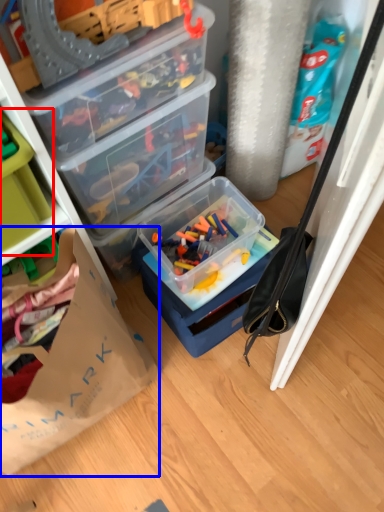
Question: Which of the following is the farthest to the observer, storage box (highlighted by a red box) or paper bag (highlighted by a blue box)?

Choices:
 (A) storage box
 (B) paper bag

Answer: (A)